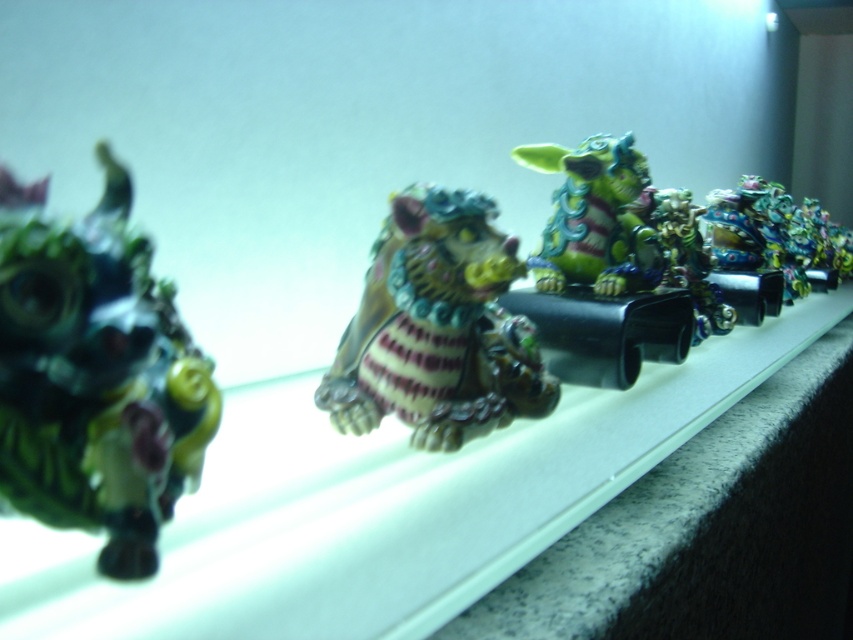
Between shiny green and purple figurine at center and metallic gold dragon at center, which one has more height?

metallic gold dragon at center is taller.

Which is more to the right, shiny green and purple figurine at center or metallic gold dragon at center?

From the viewer's perspective, metallic gold dragon at center appears more on the right side.

You are a GUI agent. You are given a task and a screenshot of the screen. Output one action in this format:
    pyautogui.click(x=<x>, y=<y>)
    Task: Click on the shiny green and purple figurine at center
    The image size is (853, 640).
    Given the screenshot: What is the action you would take?
    pyautogui.click(x=595, y=218)

Between shiny green and purple figurine at center and shiny metallic dragon at right, which one appears on the left side from the viewer's perspective?

shiny green and purple figurine at center is more to the left.

Is shiny green and purple figurine at center shorter than shiny metallic dragon at right?

Correct, shiny green and purple figurine at center is not as tall as shiny metallic dragon at right.

Where is `shiny green and purple figurine at center`? This screenshot has height=640, width=853. shiny green and purple figurine at center is located at coordinates (595, 218).

Identify the location of shiny green and purple figurine at center. This screenshot has width=853, height=640. (595, 218).

Is shiny ceramic tiger at center positioned in front of shiny metallic dragon at right?

That is True.

Who is more distant from viewer, (397,381) or (718,209)?

The point (718,209) is more distant.

Locate an element on the screen. The image size is (853, 640). shiny ceramic tiger at center is located at coordinates (437, 328).